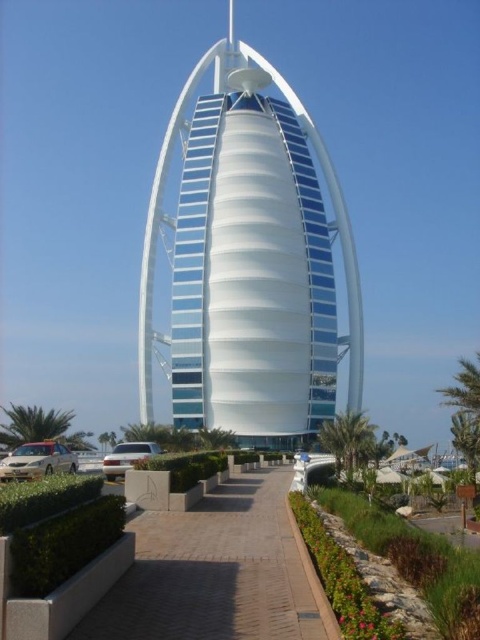
Is white glass tower at center taller than brick paved walkway at center?

Indeed, white glass tower at center has a greater height compared to brick paved walkway at center.

Can you confirm if white glass tower at center is smaller than brick paved walkway at center?

Incorrect, white glass tower at center is not smaller in size than brick paved walkway at center.

This screenshot has width=480, height=640. Identify the location of white glass tower at center. (251, 260).